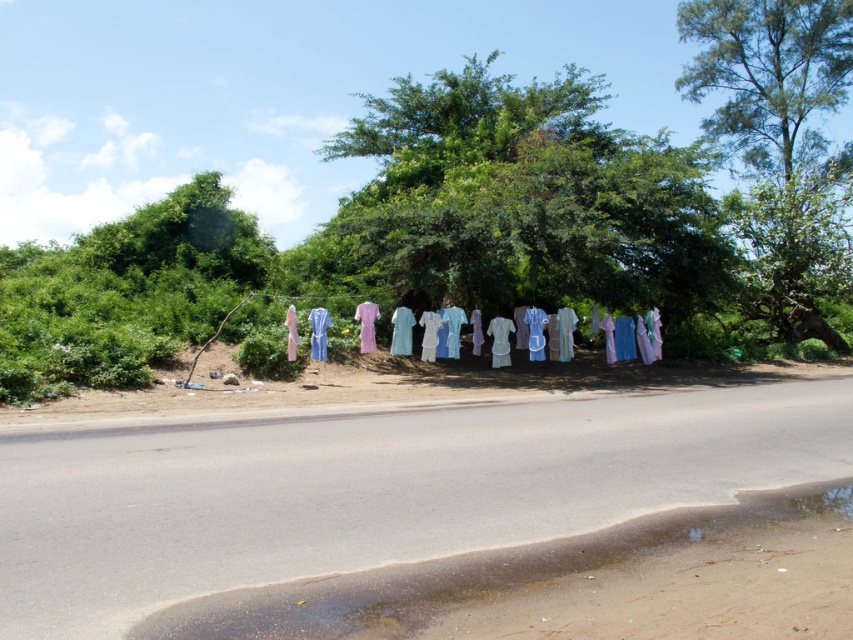
Question: Among these points, which one is farthest from the camera?

Choices:
 (A) (706, 531)
 (B) (701, 19)
 (C) (726, 259)

Answer: (B)

Question: Is green leafy tree at center below green leafy tree at upper right?

Choices:
 (A) yes
 (B) no

Answer: (B)

Question: Is brown wet asphalt at lower center to the right of green leafy tree at upper right from the viewer's perspective?

Choices:
 (A) no
 (B) yes

Answer: (A)

Question: Estimate the real-world distances between objects in this image. Which object is closer to the green leafy tree at center?

Choices:
 (A) brown wet asphalt at lower center
 (B) green leafy tree at upper right

Answer: (B)

Question: Which object appears farthest from the camera in this image?

Choices:
 (A) green leafy tree at upper right
 (B) green leafy tree at center

Answer: (A)

Question: Does brown wet asphalt at lower center appear over green leafy tree at upper right?

Choices:
 (A) yes
 (B) no

Answer: (B)